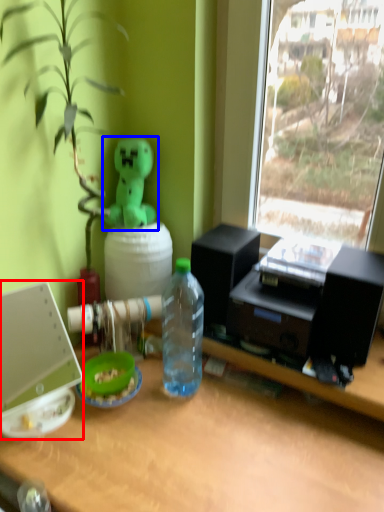
Question: Which of the following is the closest to the observer, laptop (highlighted by a red box) or toy (highlighted by a blue box)?

Choices:
 (A) laptop
 (B) toy

Answer: (A)